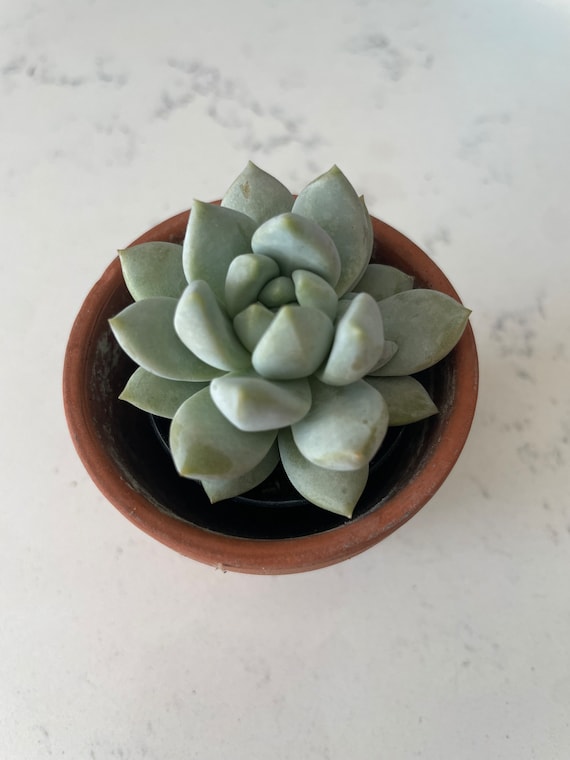
This screenshot has height=760, width=570. I want to click on clay pot rim, so click(x=328, y=548).